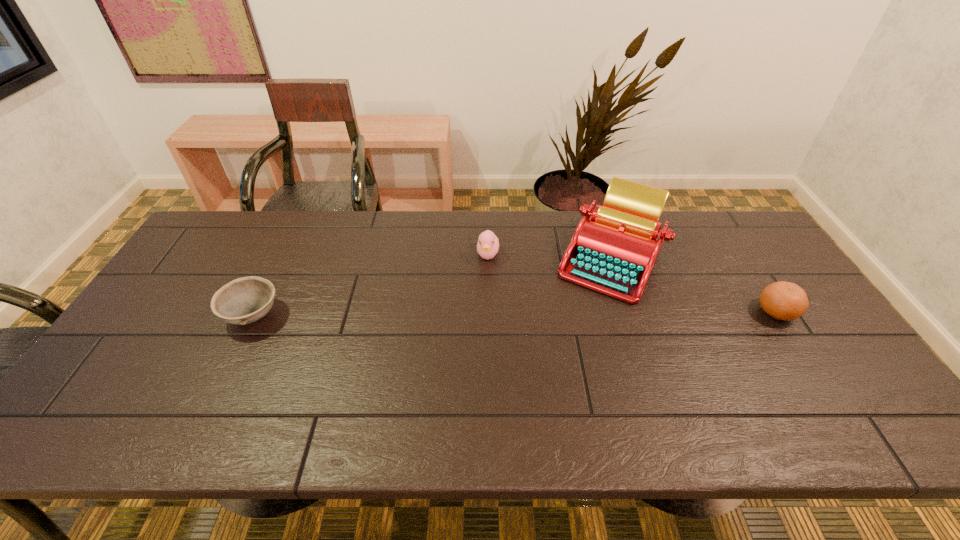
Image resolution: width=960 pixels, height=540 pixels. Find the location of `vacant space at the right edge of the desktop`. vacant space at the right edge of the desktop is located at coordinates (770, 323).

In the image, there is a desktop. Find the location of `vacant space at the far left corner`. vacant space at the far left corner is located at coordinates 218,233.

Locate an element on the screen. free space at the near left corner of the desktop is located at coordinates (117, 392).

Image resolution: width=960 pixels, height=540 pixels. Find the location of `vacant position at the far right corner of the desktop`. vacant position at the far right corner of the desktop is located at coordinates (748, 255).

Locate an element on the screen. vacant area between the third object from right to left and the tallest object is located at coordinates (549, 256).

You are a GUI agent. You are given a task and a screenshot of the screen. Output one action in this format:
    pyautogui.click(x=<x>, y=<y>)
    Task: Click on the free area in between the rightmost object and the leftmost object
    The image size is (960, 540).
    Given the screenshot: What is the action you would take?
    click(515, 313)

The width and height of the screenshot is (960, 540). What are the coordinates of `free space between the shortest object and the duckling` in the screenshot? It's located at (371, 285).

Identify the location of vacant space in between the third object from right to left and the typewriter. (549, 256).

Where is `vacant space that is in between the bowl and the second object from left to right`? This screenshot has width=960, height=540. vacant space that is in between the bowl and the second object from left to right is located at coordinates (371, 285).

Where is `vacant space that's between the tallest object and the rightmost object`? vacant space that's between the tallest object and the rightmost object is located at coordinates (693, 285).